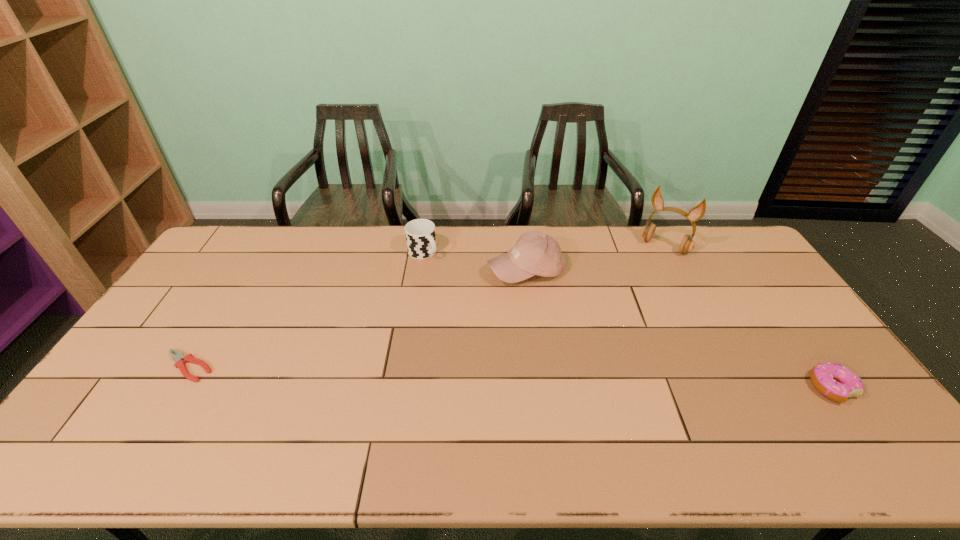
At what (x,y) coordinates should I click in order to perform the action: click on free location located 0.240m on the right of the leftmost object. Please return your answer as a coordinate pair (x, y). This screenshot has height=540, width=960. Looking at the image, I should click on (302, 367).

The image size is (960, 540). Find the location of `free space located on the left of the doughnut`. free space located on the left of the doughnut is located at coordinates (764, 388).

At what (x,y) coordinates should I click in order to perform the action: click on blank space located on the side of the fourth object from right to left with the handle. Please return your answer as a coordinate pair (x, y). This screenshot has height=540, width=960. Looking at the image, I should click on (497, 319).

At what (x,y) coordinates should I click in order to perform the action: click on free space located on the side of the fourth object from right to left with the handle. Please return your answer as a coordinate pair (x, y). Looking at the image, I should click on (440, 268).

You are a GUI agent. You are given a task and a screenshot of the screen. Output one action in this format:
    pyautogui.click(x=<x>, y=<y>)
    Task: Click on the vacant space located on the side of the fourth object from right to left with the handle
    
    Given the screenshot: What is the action you would take?
    pyautogui.click(x=444, y=273)

At what (x,y) coordinates should I click in order to perform the action: click on vacant area located 0.110m on the front-facing side of the second tallest object. Please return your answer as a coordinate pair (x, y). The width and height of the screenshot is (960, 540). Looking at the image, I should click on [x=515, y=313].

Find the location of a particular element. The height and width of the screenshot is (540, 960). free space located 0.090m on the front-facing side of the second tallest object is located at coordinates (516, 308).

You are a GUI agent. You are given a task and a screenshot of the screen. Output one action in this format:
    pyautogui.click(x=<x>, y=<y>)
    Task: Click on the free space located 0.320m on the front-facing side of the second tallest object
    
    Given the screenshot: What is the action you would take?
    pyautogui.click(x=502, y=366)

The height and width of the screenshot is (540, 960). I want to click on vacant space situated on the front-facing side of the second object from right to left, so click(647, 269).

The width and height of the screenshot is (960, 540). I want to click on free space located 0.250m on the front-facing side of the second object from right to left, so click(x=631, y=295).